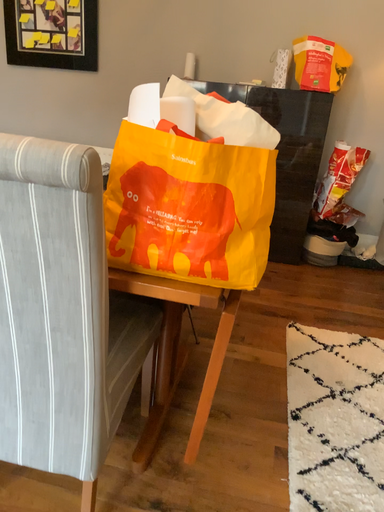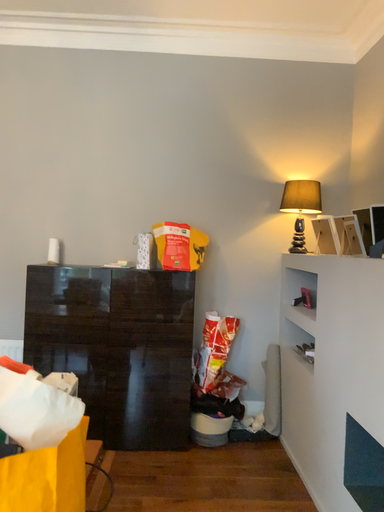
Question: Which way did the camera rotate in the video?

Choices:
 (A) rotated left
 (B) rotated right

Answer: (B)